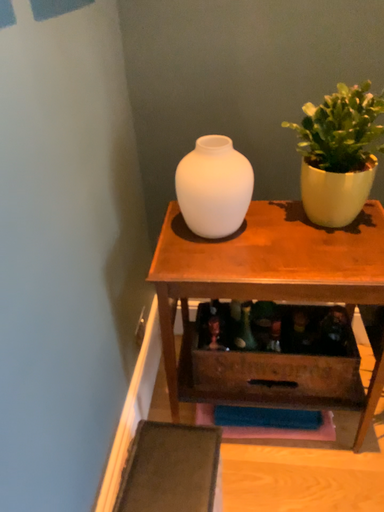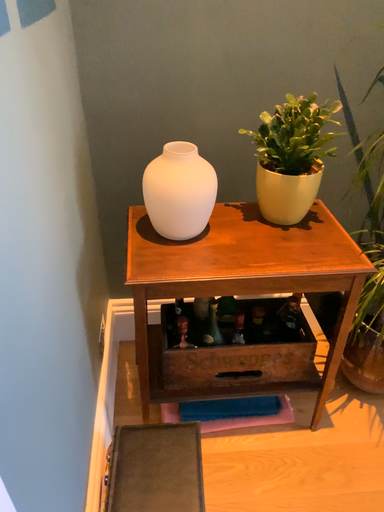
Question: How did the camera likely rotate when shooting the video?

Choices:
 (A) rotated right
 (B) rotated left

Answer: (A)